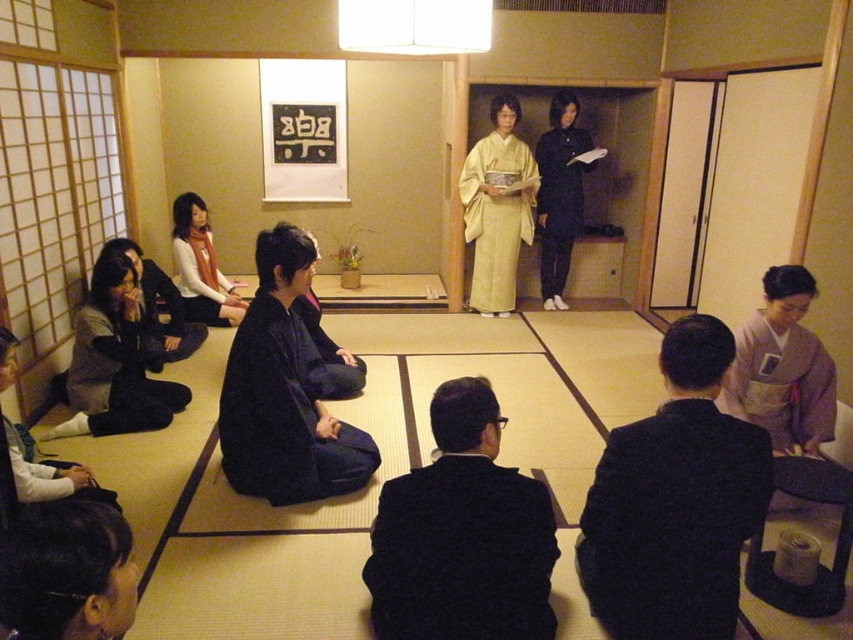
From the picture: You are standing in the traditional Japanese room and need to place a small item on the tatami mat nearest to the black silk kimono at lower left. Based on the coordinates provided, where should you place the item?

The black silk kimono at lower left is located at point (165, 314), so you should place the item near that coordinate on the tatami mat.

You are a guest at a traditional Japanese tea ceremony. You need to move from the entrance to the hostess who is wearing the purple silk kimono at lower right. There is a black silk kimono at lower left blocking your path. Is there enough space to walk between them?

The purple silk kimono at lower right and black silk kimono at lower left are 8.72 feet apart from each other, so there is sufficient space to walk between them as 8.72 feet is more than enough for a person to pass comfortably.